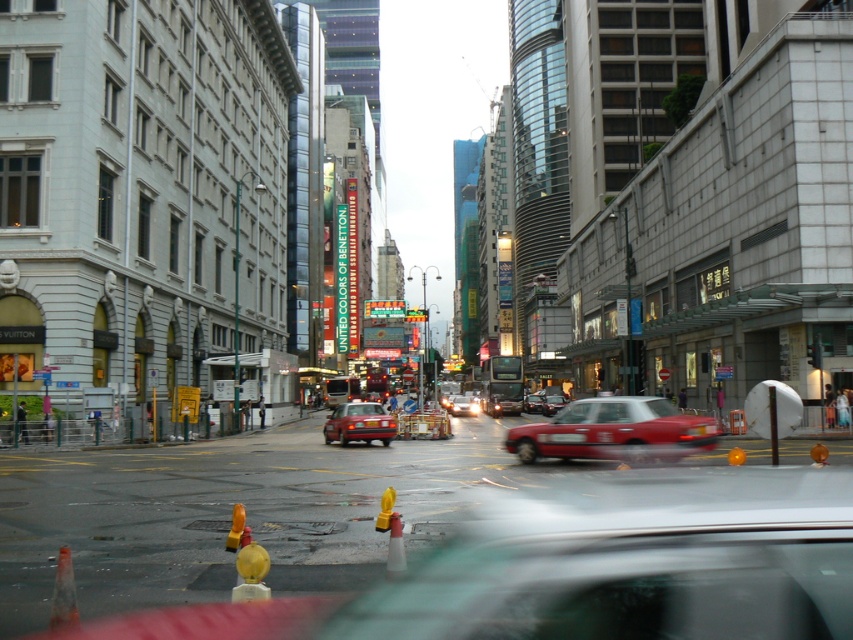
You are a pedestrian trying to cross the street. You see the metallic red taxi at center and the orange rubber traffic cone at lower center. Which object is closer to you?

The orange rubber traffic cone at lower center is closer to you because it is positioned at lower center, which is typically the front part of the image from a low angle perspective, while the metallic red taxi at center is further back in the scene.

You are a pedestrian trying to cross the street and see both the metallic red taxi at center and the matte red sedan at center. Which vehicle is closer to you?

The metallic red taxi at center is closer to you because it is in front of the matte red sedan at center.

You are a passenger in a car driving down the street. You see a point marked at coordinates [614,432]. What object is located at that point?

The point at coordinates [614,432] marks the metallic red taxi at center.